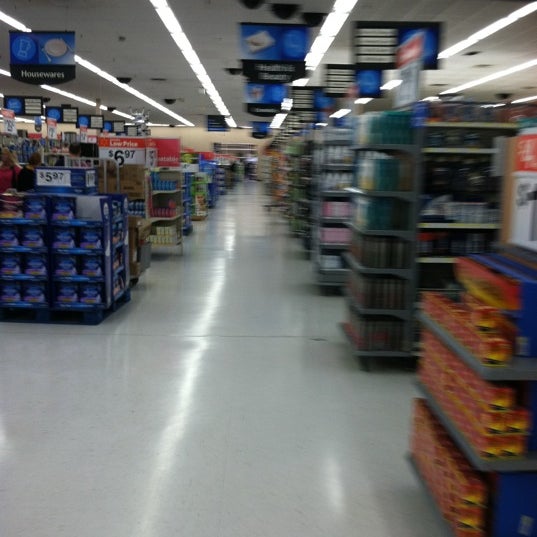
Find the location of a particular element. ceiling is located at coordinates (158, 52).